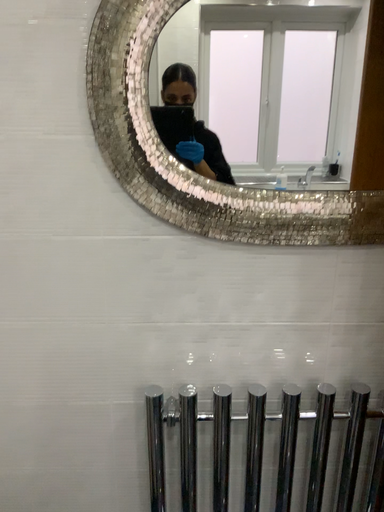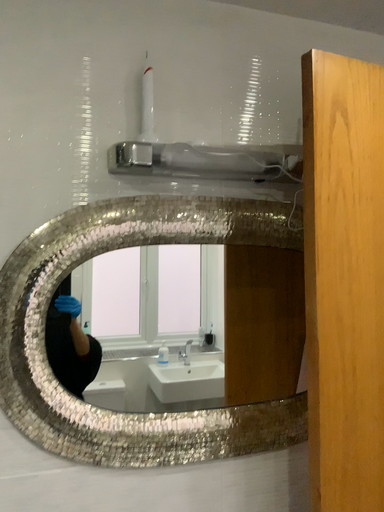
Question: Which way did the camera rotate in the video?

Choices:
 (A) rotated left
 (B) rotated right

Answer: (B)